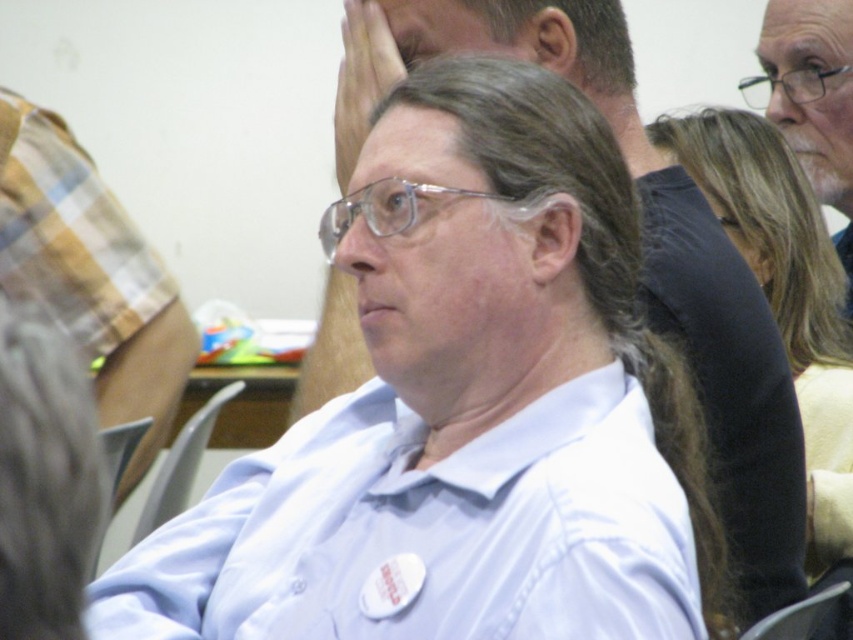
Question: Can you confirm if white matte shirt at center is positioned below white matte shirt at upper center?

Choices:
 (A) yes
 (B) no

Answer: (A)

Question: Does white matte shirt at center lie in front of dark brown hair at upper right?

Choices:
 (A) yes
 (B) no

Answer: (A)

Question: Which object is farther from the camera taking this photo?

Choices:
 (A) white matte shirt at upper center
 (B) white matte shirt at center

Answer: (A)

Question: Which is farther from the white smooth shirt at center?

Choices:
 (A) matte skin hand at upper center
 (B) matte gray chair at lower left
 (C) dark brown hair at upper right
 (D) white matte shirt at center

Answer: (C)

Question: Does matte skin hand at upper center appear on the left side of matte gray chair at lower left?

Choices:
 (A) yes
 (B) no

Answer: (B)

Question: Which object is positioned farthest from the matte skin hand at upper center?

Choices:
 (A) dark brown hair at upper right
 (B) matte gray chair at lower left
 (C) white smooth shirt at center

Answer: (A)